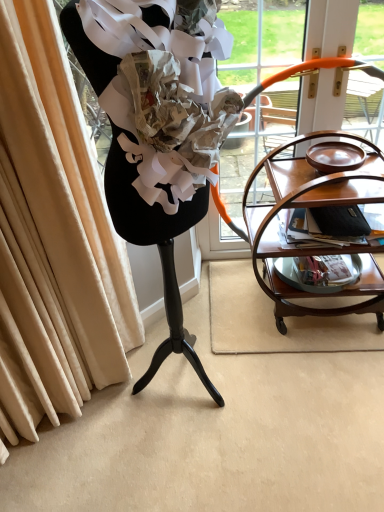
The height and width of the screenshot is (512, 384). What are the coordinates of `mahogany wood serving cart at right` in the screenshot? It's located at (314, 207).

Where is `mahogany wood serving cart at right`? The image size is (384, 512). mahogany wood serving cart at right is located at coordinates (314, 207).

Is mahogany wood serving cart at right oriented towards wooden tea cart at right?

No, mahogany wood serving cart at right is not turned towards wooden tea cart at right.

Is point (368, 175) positioned in front of point (125, 151)?

No, it is not.

Considering the sizes of objects mahogany wood serving cart at right and wooden tea cart at right in the image provided, who is taller, mahogany wood serving cart at right or wooden tea cart at right?

Standing taller between the two is wooden tea cart at right.

How many degrees apart are the facing directions of mahogany wood serving cart at right and wooden tea cart at right?

The angular difference between mahogany wood serving cart at right and wooden tea cart at right is 56.9 degrees.

Which of these two, matte brown magazine at right or mahogany wood serving cart at right, is thinner?

With smaller width is matte brown magazine at right.

In the scene shown: Which object is positioned more to the right, matte brown magazine at right or mahogany wood serving cart at right?

From the viewer's perspective, mahogany wood serving cart at right appears more on the right side.

The width and height of the screenshot is (384, 512). What are the coordinates of `table that is below the matte brown magazine at right (from the image's perspective)` in the screenshot? It's located at (314, 207).

Looking at this image, is matte brown magazine at right turned away from mahogany wood serving cart at right?

Yes, matte brown magazine at right is positioned with its back facing mahogany wood serving cart at right.

Could matte brown magazine at right be considered to be inside wooden tea cart at right?

No, matte brown magazine at right is not inside wooden tea cart at right.

Based on the photo, does wooden tea cart at right turn towards matte brown magazine at right?

No, wooden tea cart at right is not turned towards matte brown magazine at right.

Who is smaller, wooden tea cart at right or matte brown magazine at right?

matte brown magazine at right is smaller.

Which is closer to the camera, (200, 213) or (346, 240)?

The point (200, 213) is closer to the camera.

Which is less distant, (365, 234) or (160, 228)?

Point (365, 234) appears to be farther away from the viewer than point (160, 228).

How much distance is there between matte brown magazine at right and wooden tea cart at right?

matte brown magazine at right and wooden tea cart at right are 27.00 inches apart from each other.

Who is bigger, matte brown magazine at right or wooden tea cart at right?

Bigger between the two is wooden tea cart at right.

From a real-world perspective, which object stands above the other?

wooden tea cart at right, from a real-world perspective.

Between mahogany wood serving cart at right and matte brown magazine at right, which one has less height?

matte brown magazine at right.

Where is `table that appears below the matte brown magazine at right (from the image's perspective)`? table that appears below the matte brown magazine at right (from the image's perspective) is located at coordinates (314, 207).

What's the angular difference between mahogany wood serving cart at right and matte brown magazine at right's facing directions?

There is a 13.7-degree angle between the facing directions of mahogany wood serving cart at right and matte brown magazine at right.

Can you confirm if mahogany wood serving cart at right is smaller than matte brown magazine at right?

Incorrect, mahogany wood serving cart at right is not smaller in size than matte brown magazine at right.

Is wooden tea cart at right taller or shorter than mahogany wood serving cart at right?

In the image, wooden tea cart at right appears to be taller than mahogany wood serving cart at right.

What's the angular difference between wooden tea cart at right and mahogany wood serving cart at right's facing directions?

They differ by 56.9 degrees in their facing directions.

Can you confirm if wooden tea cart at right is positioned to the right of mahogany wood serving cart at right?

No.

The width and height of the screenshot is (384, 512). In order to click on furniture in front of the mahogany wood serving cart at right in this screenshot , I will do `click(157, 245)`.

At what (x,y) coordinates should I click in order to perform the action: click on table below the matte brown magazine at right (from the image's perspective). Please return your answer as a coordinate pair (x, y). Looking at the image, I should click on (314, 207).

Which object lies further to the anchor point wooden tea cart at right, matte brown magazine at right or mahogany wood serving cart at right?

The object further to wooden tea cart at right is matte brown magazine at right.

Based on the photo, from the image, which object appears to be nearer to matte brown magazine at right, wooden tea cart at right or mahogany wood serving cart at right?

Based on the image, mahogany wood serving cart at right appears to be nearer to matte brown magazine at right.

Based on their spatial positions, is mahogany wood serving cart at right or matte brown magazine at right closer to wooden tea cart at right?

mahogany wood serving cart at right is closer to wooden tea cart at right.

From the image, which object appears to be farther from mahogany wood serving cart at right, wooden tea cart at right or matte brown magazine at right?

wooden tea cart at right is further to mahogany wood serving cart at right.

When comparing their distances from mahogany wood serving cart at right, does matte brown magazine at right or wooden tea cart at right seem closer?

Based on the image, matte brown magazine at right appears to be nearer to mahogany wood serving cart at right.

Considering their positions, is mahogany wood serving cart at right positioned further to matte brown magazine at right than wooden tea cart at right?

wooden tea cart at right.

Find the location of a particular element. This screenshot has height=512, width=384. table between wooden tea cart at right and matte brown magazine at right along the z-axis is located at coordinates (314, 207).